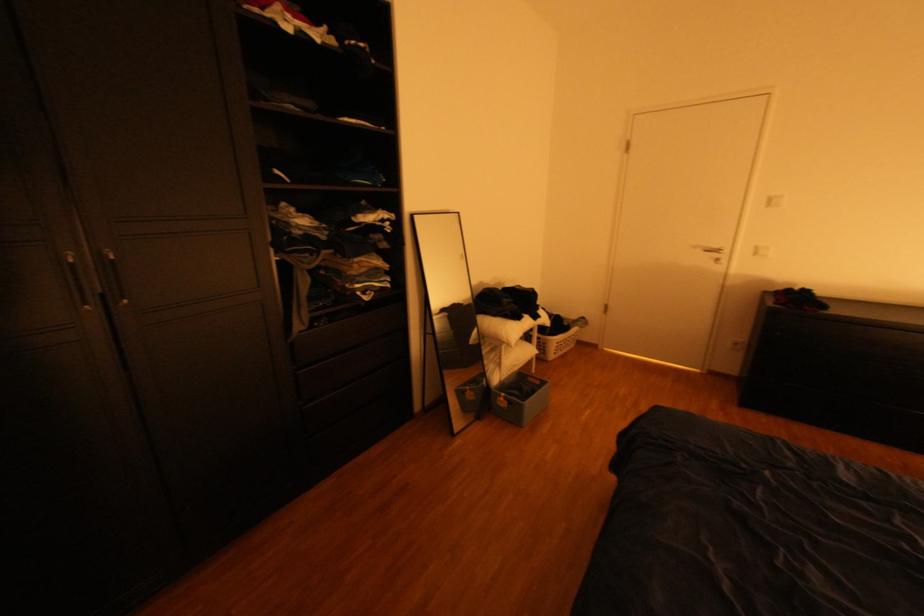
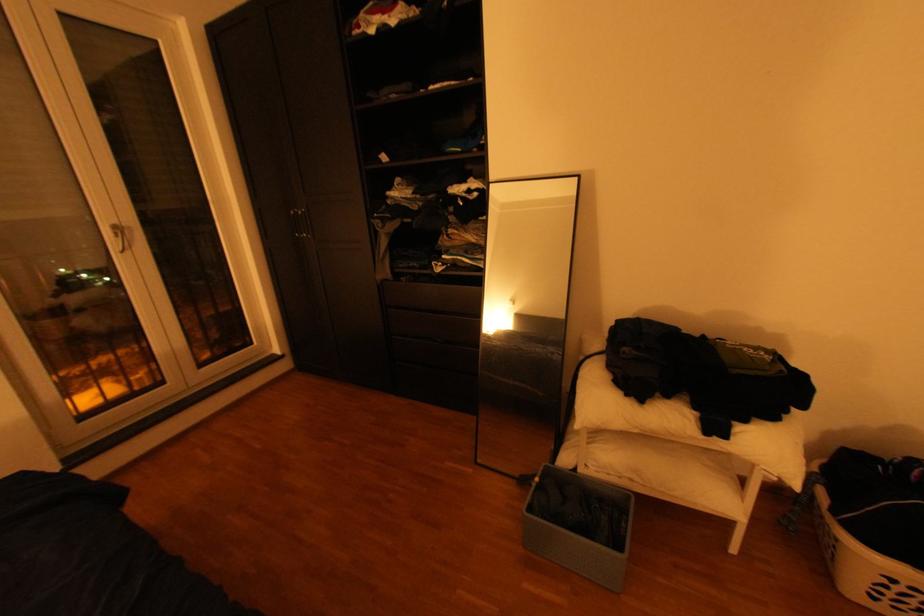
The point at (x=550, y=317) is marked in the first image. Where is the corresponding point in the second image?

(735, 436)